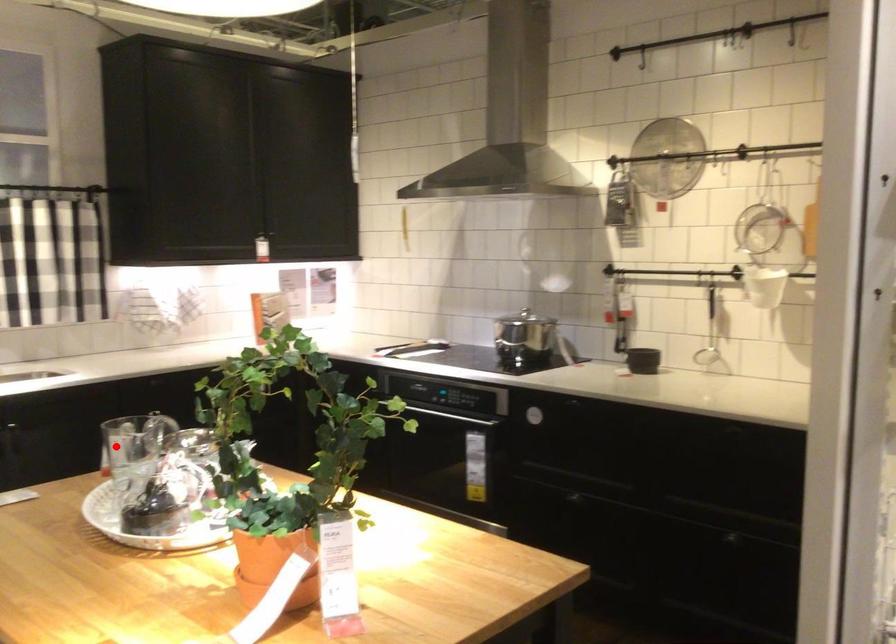
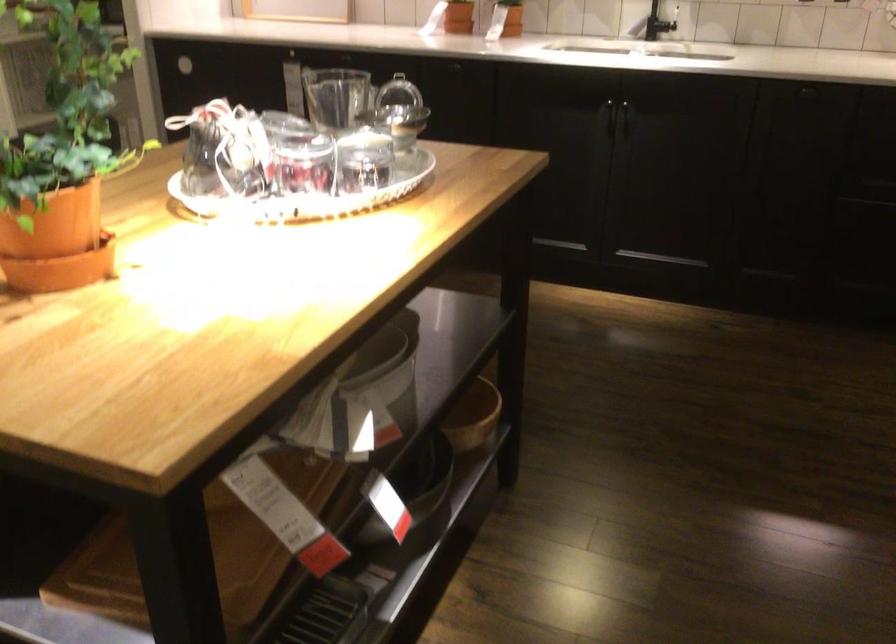
The point at the highlighted location is marked in the first image. Where is the corresponding point in the second image?

(334, 96)